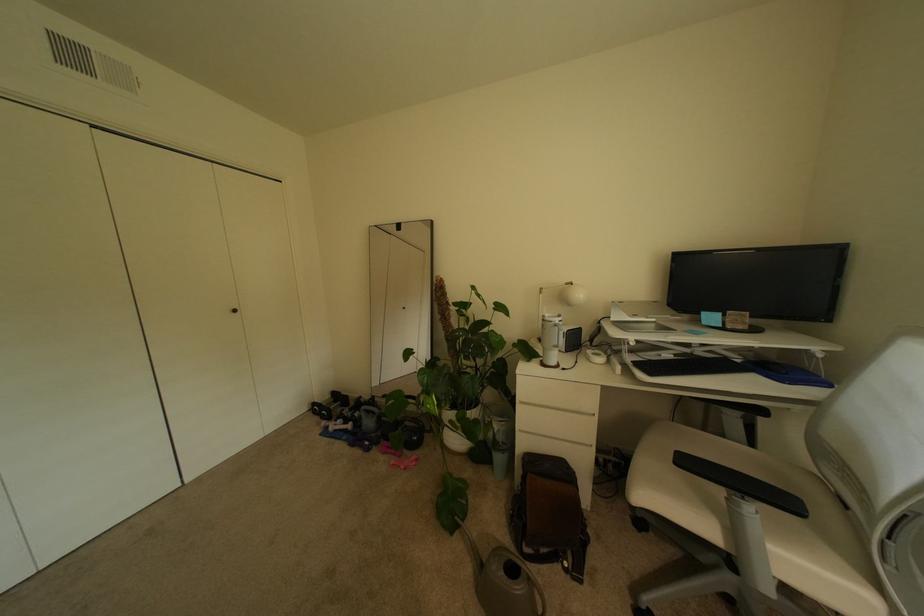
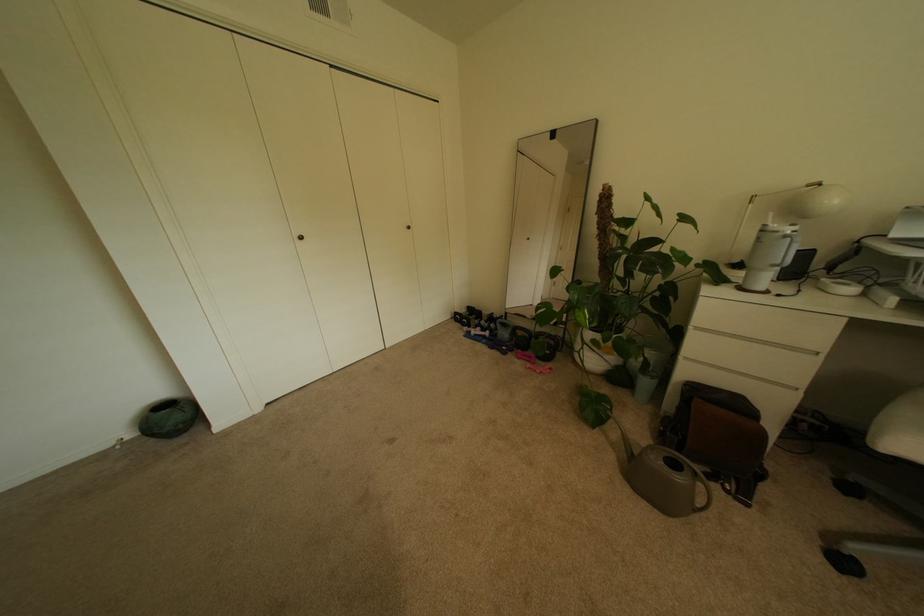
In the second image, find the point that corresponds to [541,461] in the first image.

(704, 391)